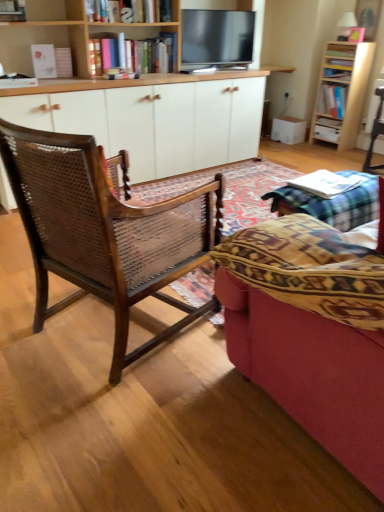
Question: Can you confirm if flat screen tv at upper center is positioned to the left of white paper book at center, which is counted as the 1th book, starting from the left?

Choices:
 (A) yes
 (B) no

Answer: (A)

Question: From the image's perspective, does flat screen tv at upper center appear higher than white paper book at center, the 3th book when ordered from right to left?

Choices:
 (A) yes
 (B) no

Answer: (A)

Question: From a real-world perspective, is flat screen tv at upper center positioned under white paper book at center, which is the 1th book in front-to-back order, based on gravity?

Choices:
 (A) no
 (B) yes

Answer: (A)

Question: Does flat screen tv at upper center have a lesser height compared to white paper book at center, the 3th book when ordered from right to left?

Choices:
 (A) no
 (B) yes

Answer: (A)

Question: Is there a large distance between flat screen tv at upper center and white paper book at center, the 3th book in the top-to-bottom sequence?

Choices:
 (A) no
 (B) yes

Answer: (B)

Question: Considering the positions of white wood cabinet at center and white glossy drawer at center in the image, is white wood cabinet at center taller or shorter than white glossy drawer at center?

Choices:
 (A) tall
 (B) short

Answer: (A)

Question: Relative to white glossy drawer at center, is white wood cabinet at center in front or behind?

Choices:
 (A) behind
 (B) front

Answer: (B)

Question: Considering the positions of point (157, 89) and point (327, 130), is point (157, 89) closer or farther from the camera than point (327, 130)?

Choices:
 (A) closer
 (B) farther

Answer: (A)

Question: In the image, is white wood cabinet at center on the left side or the right side of white glossy drawer at center?

Choices:
 (A) left
 (B) right

Answer: (A)

Question: Considering the positions of flat screen tv at upper center and wooden bookshelf at upper center, which is the 1th bookcase in left-to-right order, in the image, is flat screen tv at upper center bigger or smaller than wooden bookshelf at upper center, which is the 1th bookcase in left-to-right order,?

Choices:
 (A) small
 (B) big

Answer: (A)

Question: Considering the relative positions of flat screen tv at upper center and wooden bookshelf at upper center, which appears as the second bookcase when viewed from the right, in the image provided, is flat screen tv at upper center to the left or to the right of wooden bookshelf at upper center, which appears as the second bookcase when viewed from the right,?

Choices:
 (A) right
 (B) left

Answer: (A)

Question: From the image's perspective, relative to wooden bookshelf at upper center, which appears as the second bookcase when viewed from the right, is flat screen tv at upper center above or below?

Choices:
 (A) below
 (B) above

Answer: (B)

Question: Is flat screen tv at upper center spatially inside wooden bookshelf at upper center, the second bookcase positioned from the back, or outside of it?

Choices:
 (A) outside
 (B) inside

Answer: (B)

Question: Is flat screen tv at upper center taller or shorter than white wood cabinet at center?

Choices:
 (A) tall
 (B) short

Answer: (B)

Question: From the image's perspective, is flat screen tv at upper center located above or below white wood cabinet at center?

Choices:
 (A) above
 (B) below

Answer: (A)